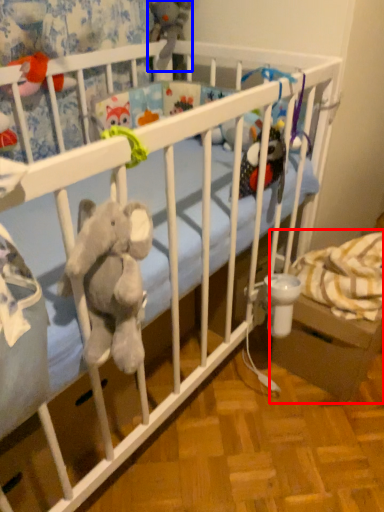
Question: Which of the following is the farthest to the observer, baby carriage (highlighted by a red box) or toy (highlighted by a blue box)?

Choices:
 (A) baby carriage
 (B) toy

Answer: (B)